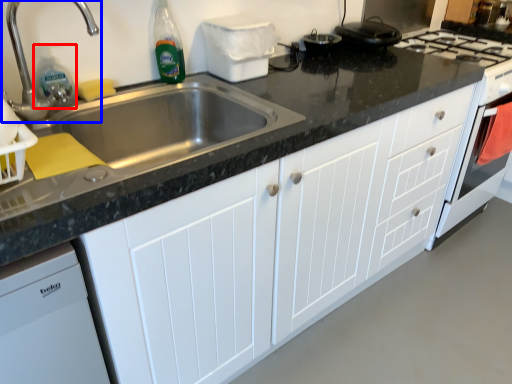
Question: Which point is closer to the camera, cleaning product (highlighted by a red box) or tap (highlighted by a blue box)?

Choices:
 (A) cleaning product
 (B) tap

Answer: (B)